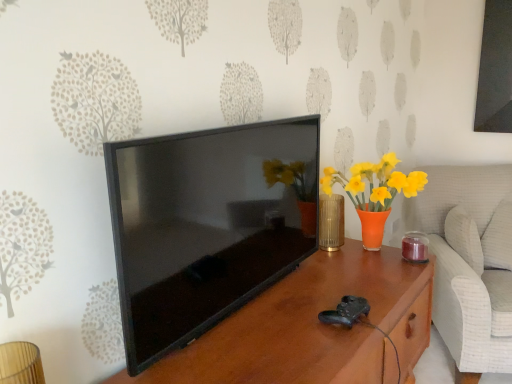
This screenshot has height=384, width=512. I want to click on vacant region below black glossy tv at center (from a real-world perspective), so click(x=244, y=306).